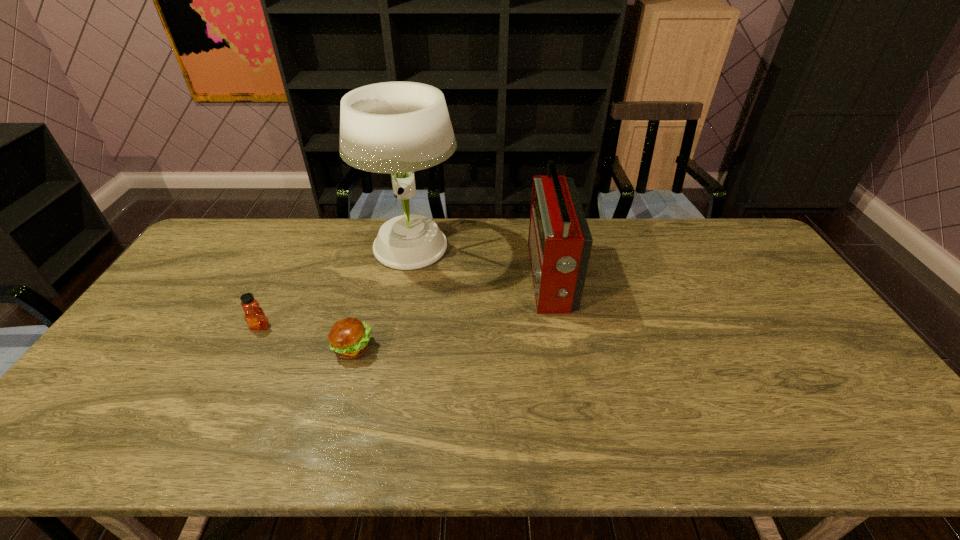
You are a GUI agent. You are given a task and a screenshot of the screen. Output one action in this format:
    pyautogui.click(x=<x>, y=<y>)
    Task: Click on the vacant area that lies between the tallest object and the shortest object
    This screenshot has width=960, height=540.
    Given the screenshot: What is the action you would take?
    pyautogui.click(x=382, y=298)

This screenshot has height=540, width=960. I want to click on free spot between the lamp and the leftmost object, so click(336, 288).

This screenshot has width=960, height=540. Identify the location of free space between the tallest object and the second tallest object. 481,264.

Where is `unoccupied position between the hamburger and the leftmost object`? This screenshot has height=540, width=960. unoccupied position between the hamburger and the leftmost object is located at coordinates (306, 337).

The image size is (960, 540). I want to click on vacant area between the tallest object and the hamburger, so click(x=382, y=298).

This screenshot has width=960, height=540. I want to click on vacant area between the rightmost object and the leftmost object, so click(x=405, y=302).

Locate an element on the screen. vacant area that lies between the honey and the lamp is located at coordinates (336, 288).

Find the location of a particular element. The width and height of the screenshot is (960, 540). empty space between the hamburger and the rightmost object is located at coordinates [x=451, y=313].

Identify which object is the closest to the radio receiver. Please provide its 2D coordinates. Your answer should be formatted as a tuple, i.e. [(x, y)], where the tuple contains the x and y coordinates of a point satisfying the conditions above.

[(397, 128)]

This screenshot has height=540, width=960. I want to click on object that ranks as the third closest to the tallest object, so click(x=255, y=317).